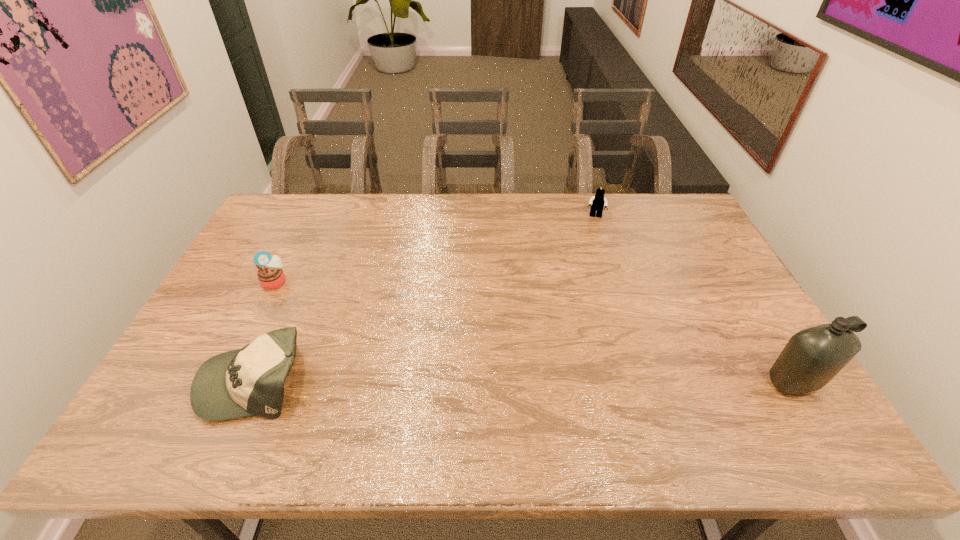
Where is `baseball cap`? baseball cap is located at coordinates (244, 382).

In order to click on bottle in this screenshot , I will do `click(812, 357)`.

At what (x,y) coordinates should I click in order to perform the action: click on the rightmost object. Please return your answer as a coordinate pair (x, y). Looking at the image, I should click on (812, 357).

Where is `the third nearest object`? the third nearest object is located at coordinates (270, 274).

Where is `Lego`? Lego is located at coordinates tap(597, 202).

I want to click on the farthest object, so click(597, 202).

The height and width of the screenshot is (540, 960). Identify the location of vacant position located on the front-facing side of the baseball cap. (184, 380).

Locate an element on the screen. This screenshot has height=540, width=960. free location located on the front-facing side of the baseball cap is located at coordinates (180, 380).

Where is `free region located 0.160m on the front-facing side of the muffin`? This screenshot has height=540, width=960. free region located 0.160m on the front-facing side of the muffin is located at coordinates (320, 308).

At what (x,y) coordinates should I click in order to perform the action: click on vacant area situated 0.090m on the front-facing side of the muffin. Please return your answer as a coordinate pair (x, y). This screenshot has width=960, height=540. Looking at the image, I should click on coord(302,298).